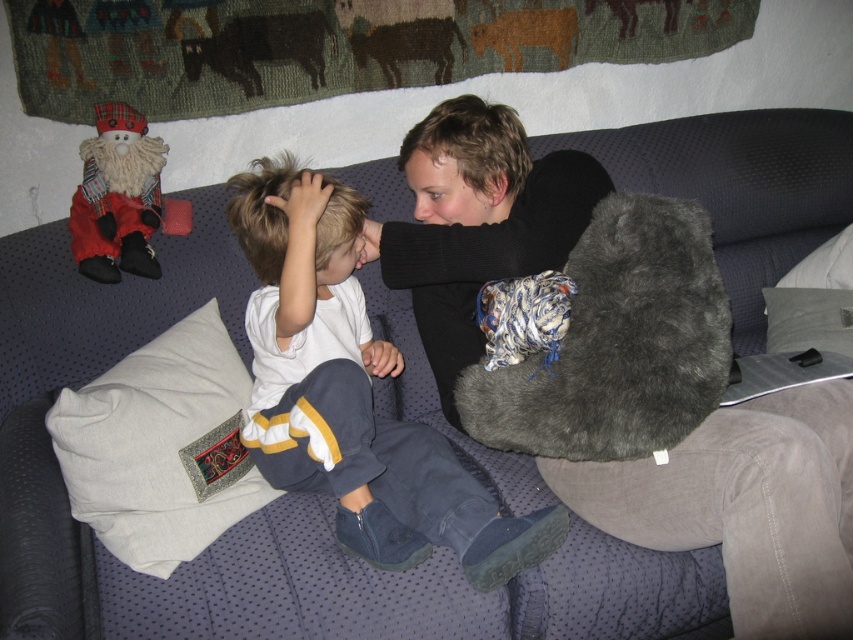
You are a photographer taking a picture of the two children on the dark blue couch. You notice the fuzzy red santa at upper left and the brown wool cow at upper center in the background. Which of these two objects will appear larger in your photo?

The fuzzy red santa at upper left will appear larger in the photo because it is closer to the viewer than the brown wool cow at upper center.

You are a robot trying to determine the order of two points in the image. Given that point A is at coordinates point (119,264) and point B is at coordinates point (241,17), which point is closer to the viewer?

Point A is closer to the viewer because it is in front of point B.

You are a parent trying to decide which stuffed animal to give to your child. Both the fuzzy red santa at upper left and the dark brown wool cow at upper left are on the couch. Which one is bigger?

The fuzzy red santa at upper left is larger in size compared to the dark brown wool cow at upper left.